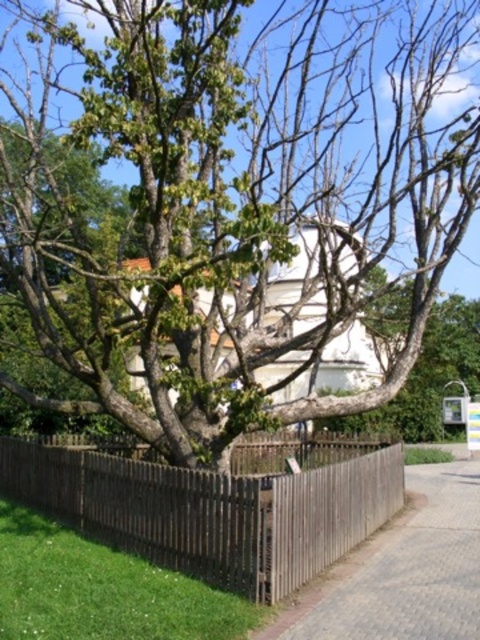
Does green leafy tree at center appear on the right side of brown wooden fence at lower center?

Yes, green leafy tree at center is to the right of brown wooden fence at lower center.

Can you confirm if green leafy tree at center is positioned to the left of brown wooden fence at lower center?

No, green leafy tree at center is not to the left of brown wooden fence at lower center.

Is point (86, 300) farther from viewer compared to point (327, 529)?

That is True.

The width and height of the screenshot is (480, 640). I want to click on green leafy tree at center, so click(237, 204).